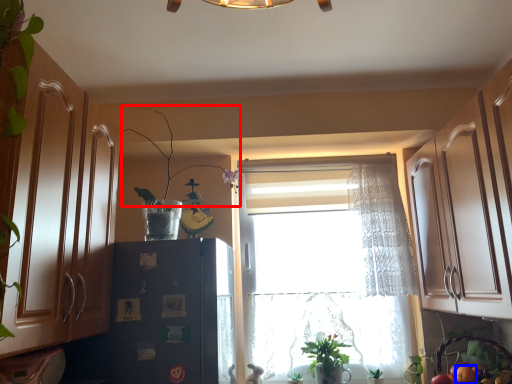
Question: Which object is further to the camera taking this photo, plant (highlighted by a red box) or fruit (highlighted by a blue box)?

Choices:
 (A) plant
 (B) fruit

Answer: (B)